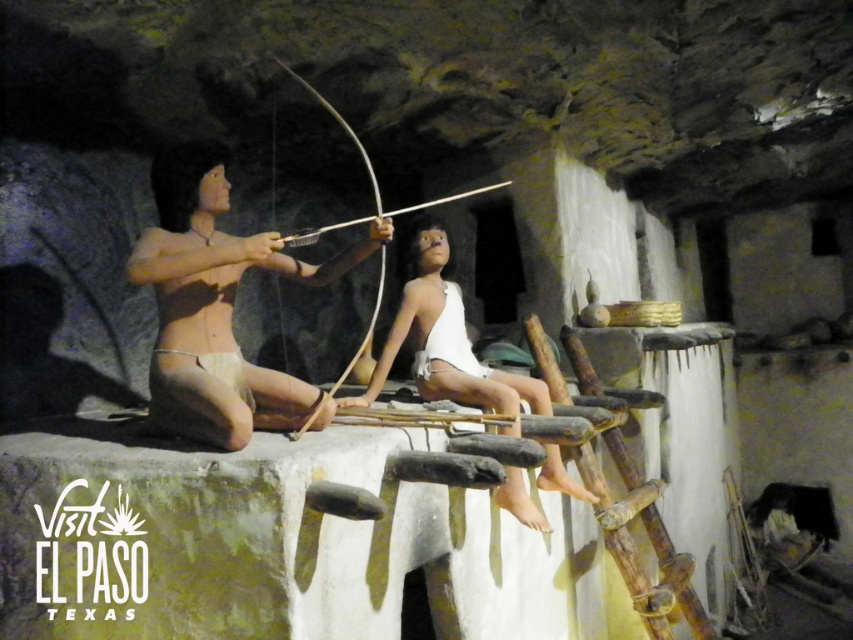
Question: Which point is farther to the camera?

Choices:
 (A) wooden bow and arrow at center
 (B) white matte wood at center

Answer: (B)

Question: Is white matte wood at center bigger than wooden bow and arrow at center?

Choices:
 (A) no
 (B) yes

Answer: (A)

Question: Which object is the closest to the wooden bow and arrow at center?

Choices:
 (A) white matte wood at center
 (B) matte tan skin at center

Answer: (B)

Question: Is matte tan skin at center positioned behind wooden bow and arrow at center?

Choices:
 (A) yes
 (B) no

Answer: (B)

Question: Which is farther from the wooden bow and arrow at center?

Choices:
 (A) matte tan skin at center
 (B) white matte wood at center

Answer: (B)

Question: Can you confirm if matte tan skin at center is positioned to the right of white matte wood at center?

Choices:
 (A) yes
 (B) no

Answer: (B)